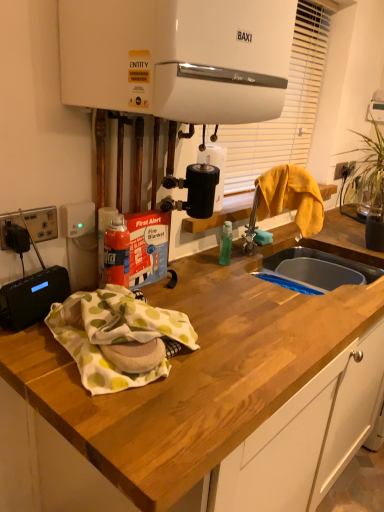
Question: Looking at the image, does black plastic socket at left seem bigger or smaller compared to green leafy plant at right?

Choices:
 (A) small
 (B) big

Answer: (A)

Question: Considering the relative positions of black plastic socket at left and green leafy plant at right in the image provided, is black plastic socket at left to the left or to the right of green leafy plant at right?

Choices:
 (A) right
 (B) left

Answer: (B)

Question: Which object is the farthest from the yellow fabric at sink?

Choices:
 (A) white plastic blind at upper center
 (B) white glossy boiler at upper center
 (C) black plastic socket at left
 (D) wooden at center
 (E) green leafy plant at right

Answer: (C)

Question: Which object is positioned farthest from the white plastic blind at upper center?

Choices:
 (A) white glossy boiler at upper center
 (B) black plastic socket at left
 (C) yellow fabric at sink
 (D) green leafy plant at right
 (E) wooden at center

Answer: (B)